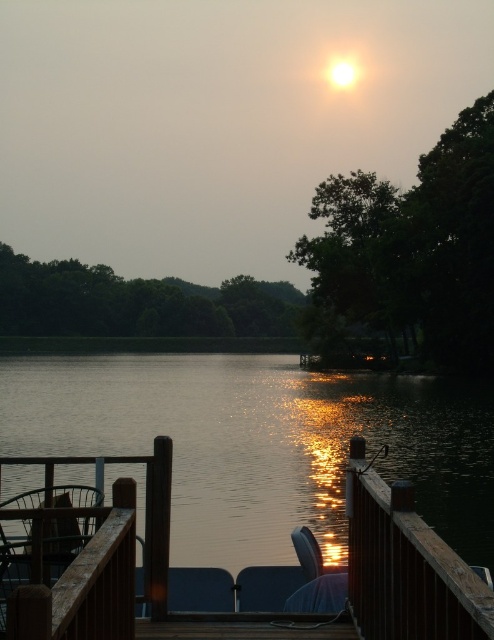
Which is above, wooden chair at lower left or matte plastic chair at lower center?

wooden chair at lower left is higher up.

Does point (2, 552) come in front of point (198, 600)?

Yes, it is in front of point (198, 600).

Does point (80, 532) come farther from viewer compared to point (214, 588)?

No.

You are a GUI agent. You are given a task and a screenshot of the screen. Output one action in this format:
    pyautogui.click(x=<x>, y=<y>)
    Task: Click on the wooden chair at lower left
    The height and width of the screenshot is (640, 494).
    Given the screenshot: What is the action you would take?
    pyautogui.click(x=64, y=541)

Is brown wooden rail at center wider than wooden chair at lower left?

Incorrect, brown wooden rail at center's width does not surpass wooden chair at lower left's.

Who is positioned more to the right, brown wooden rail at center or wooden chair at lower left?

brown wooden rail at center

Describe the element at coordinates (406, 566) in the screenshot. I see `brown wooden rail at center` at that location.

You are a GUI agent. You are given a task and a screenshot of the screen. Output one action in this format:
    pyautogui.click(x=<x>, y=<y>)
    Task: Click on the brown wooden rail at center
    
    Given the screenshot: What is the action you would take?
    pyautogui.click(x=406, y=566)

Can you confirm if matte plastic chair at lower center is smaller than matte blue chair at lower center?

Incorrect, matte plastic chair at lower center is not smaller in size than matte blue chair at lower center.

The height and width of the screenshot is (640, 494). I want to click on matte plastic chair at lower center, so click(x=200, y=589).